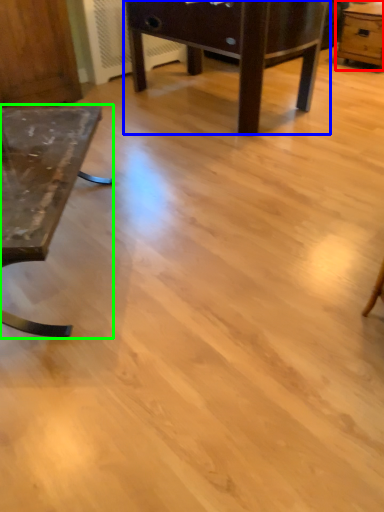
Question: Estimate the real-world distances between objects in this image. Which object is farther from table (highlighted by a red box), table (highlighted by a blue box) or table (highlighted by a green box)?

Choices:
 (A) table
 (B) table

Answer: (B)